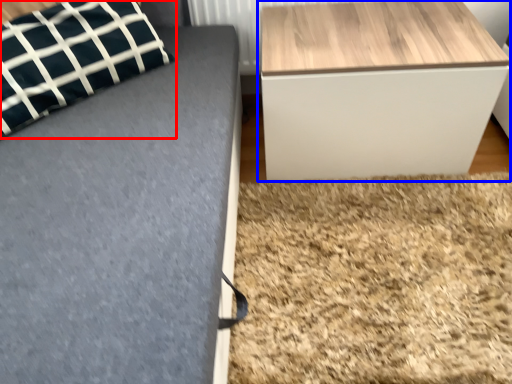
Question: Among these objects, which one is farthest to the camera, pillow (highlighted by a red box) or table (highlighted by a blue box)?

Choices:
 (A) pillow
 (B) table

Answer: (B)